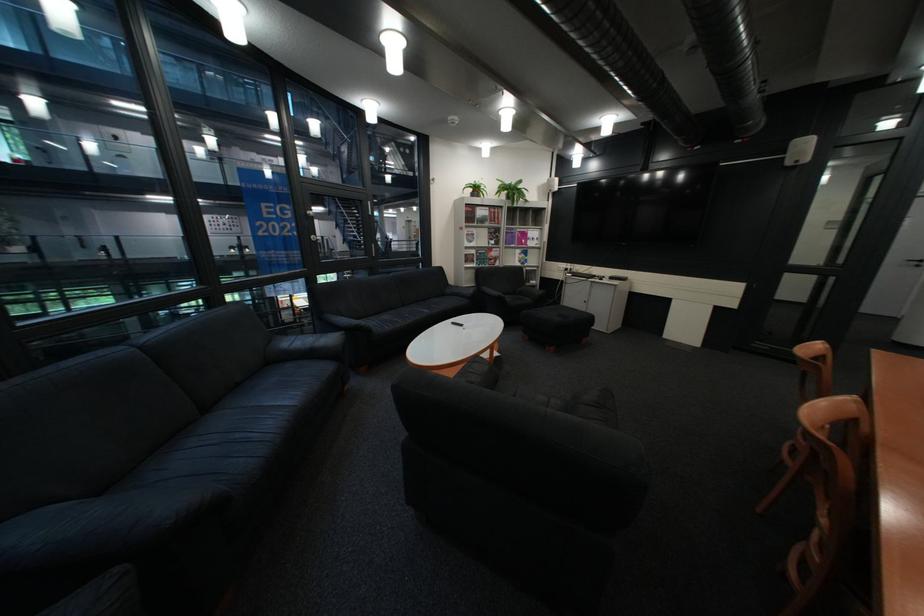
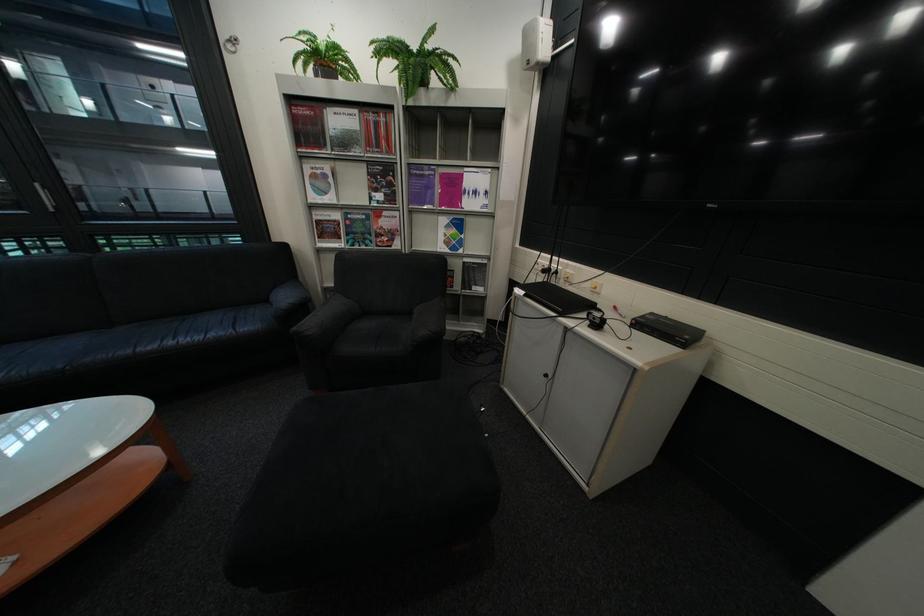
Find the pixel in the second image that matches [524,184] in the first image.

(430, 46)